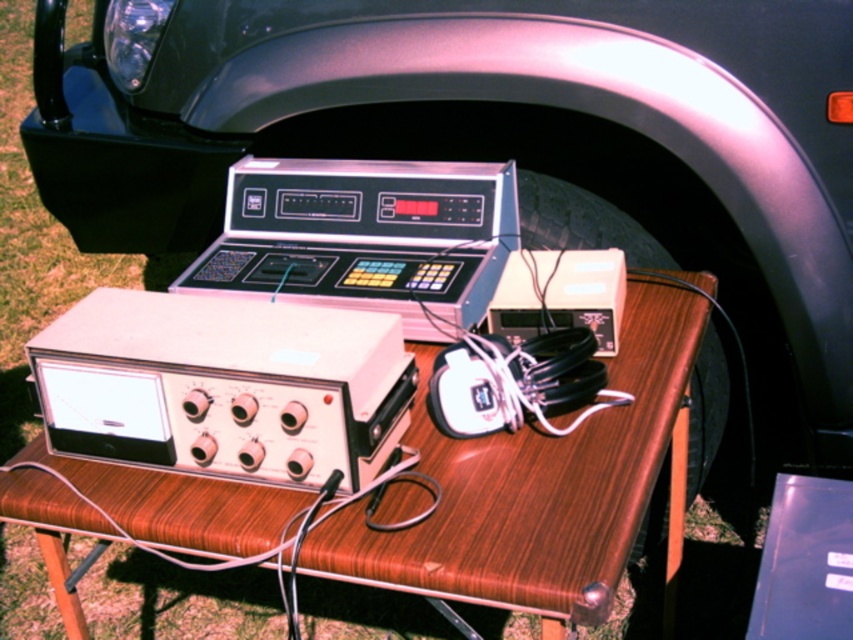
Can you confirm if wooden table at center is wider than metallic silver calculator at center?

Yes.

Between wooden table at center and metallic silver calculator at center, which one has more height?

Standing taller between the two is wooden table at center.

At what (x,y) coordinates should I click in order to perform the action: click on wooden table at center. Please return your answer as a coordinate pair (x, y). This screenshot has height=640, width=853. Looking at the image, I should click on (543, 490).

Image resolution: width=853 pixels, height=640 pixels. What are the coordinates of `wooden table at center` in the screenshot? It's located at (543, 490).